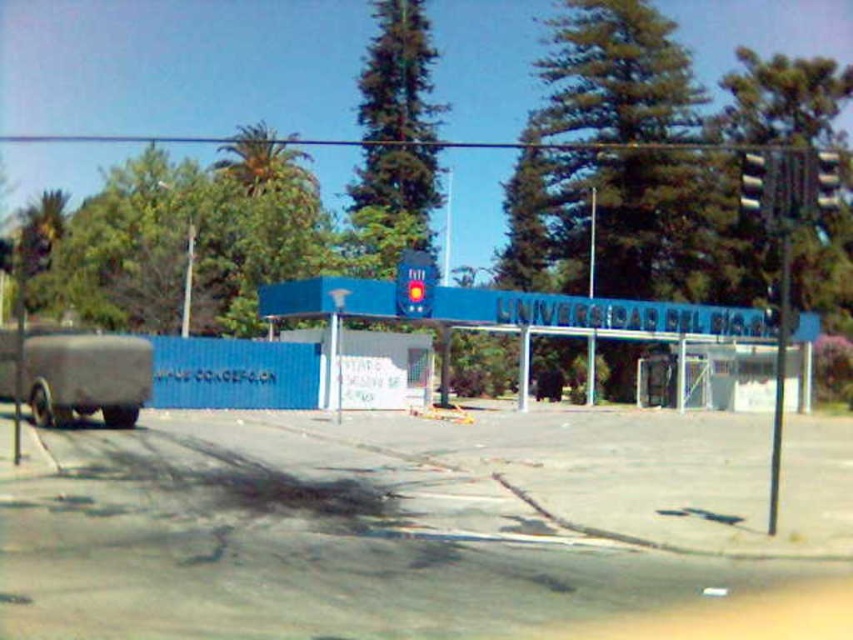
Does point (39, 410) lie behind point (590, 339)?

No, it is not.

Does point (106, 339) come farther from viewer compared to point (596, 198)?

No, (106, 339) is in front of (596, 198).

I want to click on matte gray trailer at left, so click(x=85, y=376).

Who is lower down, matte gray trailer at left or metallic pole at right?

matte gray trailer at left is below.

Is matte gray trailer at left positioned behind metallic pole at right?

Yes, matte gray trailer at left is further from the viewer.

Image resolution: width=853 pixels, height=640 pixels. Identify the location of matte gray trailer at left. (85, 376).

From the picture: Measure the distance between metallic pole at right and camera.

metallic pole at right is 11.74 meters from camera.

Can you confirm if metallic pole at right is shorter than black plastic traffic light at upper right?

Yes, metallic pole at right is shorter than black plastic traffic light at upper right.

Image resolution: width=853 pixels, height=640 pixels. What do you see at coordinates (779, 376) in the screenshot? I see `metallic pole at right` at bounding box center [779, 376].

Locate an element on the screen. The image size is (853, 640). metallic pole at right is located at coordinates (779, 376).